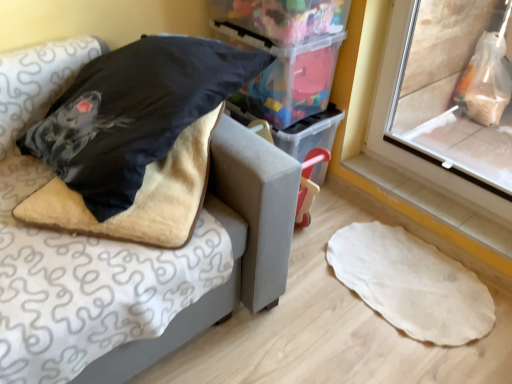
Locate an element on the screen. The width and height of the screenshot is (512, 384). free location to the left of white felt rug at lower right is located at coordinates tap(302, 306).